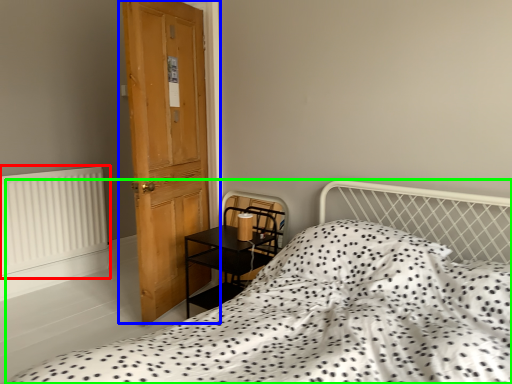
Question: Which is farther away from radiator (highlighted by a red box)? door (highlighted by a blue box) or bed (highlighted by a green box)?

Choices:
 (A) door
 (B) bed

Answer: (B)